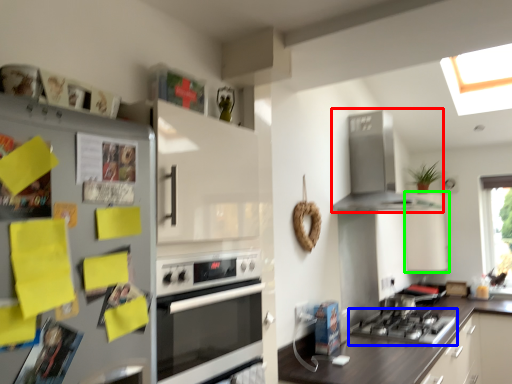
Question: Estimate the real-world distances between objects in this image. Which object is farther from home appliance (highlighted by a red box), gas stove (highlighted by a blue box) or cabinetry (highlighted by a green box)?

Choices:
 (A) gas stove
 (B) cabinetry

Answer: (A)